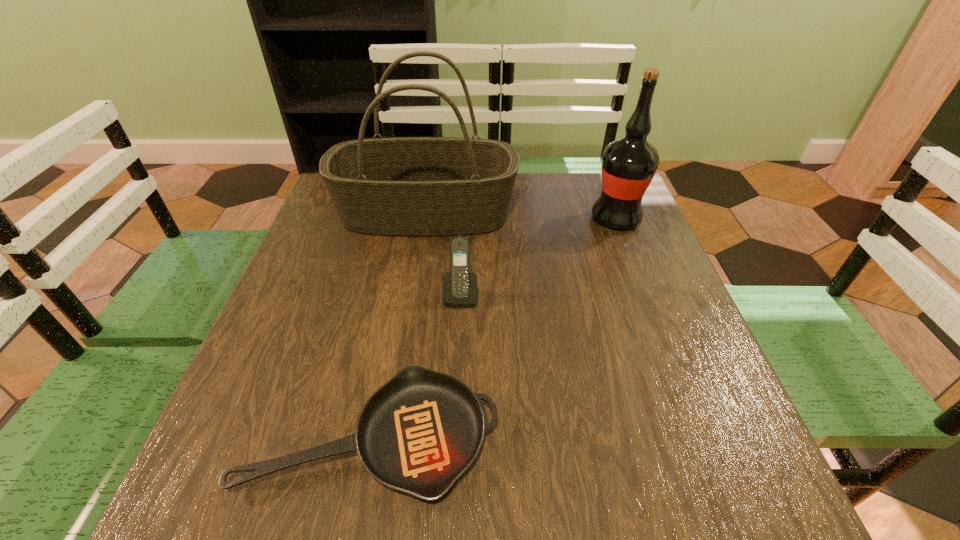
Where is `free point between the nearest object and the third tallest object`? free point between the nearest object and the third tallest object is located at coordinates (417, 366).

Image resolution: width=960 pixels, height=540 pixels. In order to click on free spot between the third farthest object and the frying pan in this screenshot , I will do `click(417, 366)`.

At what (x,y) coordinates should I click in order to perform the action: click on free space between the nearest object and the third farthest object. Please return your answer as a coordinate pair (x, y). Looking at the image, I should click on (417, 366).

Find the location of a particular element. vacant area that lies between the nearest object and the third tallest object is located at coordinates (417, 366).

This screenshot has width=960, height=540. What are the coordinates of `object that is the closest to the rightmost object` in the screenshot? It's located at (399, 186).

At what (x,y) coordinates should I click in order to perform the action: click on object that is the closest to the frying pan. Please return your answer as a coordinate pair (x, y). Looking at the image, I should click on (459, 285).